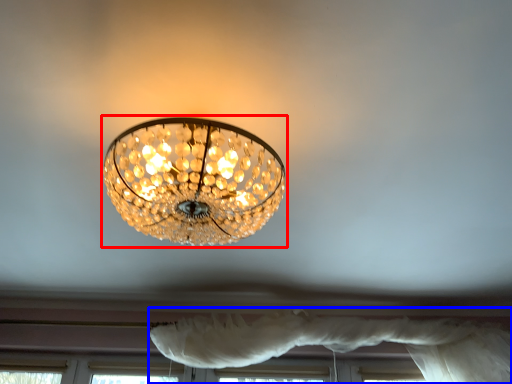
Question: Among these objects, which one is nearest to the camera, lamp (highlighted by a red box) or curtain (highlighted by a blue box)?

Choices:
 (A) lamp
 (B) curtain

Answer: (A)